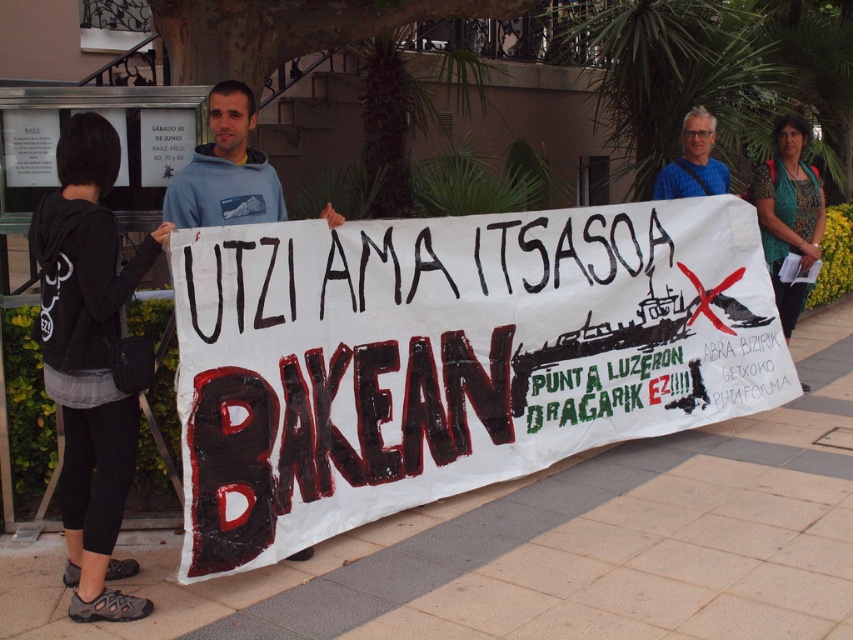
Does white paper banner at center appear under light blue hoodie at center?

Yes.

Who is more forward, [543,289] or [200,154]?

Positioned in front is point [200,154].

The height and width of the screenshot is (640, 853). I want to click on white paper banner at center, so click(x=450, y=356).

Does white paper banner at center have a smaller size compared to black fabric hoodie at left?

Actually, white paper banner at center might be larger than black fabric hoodie at left.

Is point (231, 436) positioned after point (85, 504)?

No, (231, 436) is in front of (85, 504).

This screenshot has height=640, width=853. Find the location of `white paper banner at center`. white paper banner at center is located at coordinates (450, 356).

Which is more to the left, light blue hoodie at center or blue fabric at upper center?

Positioned to the left is light blue hoodie at center.

Locate an element on the screen. This screenshot has height=640, width=853. light blue hoodie at center is located at coordinates (225, 170).

This screenshot has width=853, height=640. What are the coordinates of `light blue hoodie at center` in the screenshot? It's located at (225, 170).